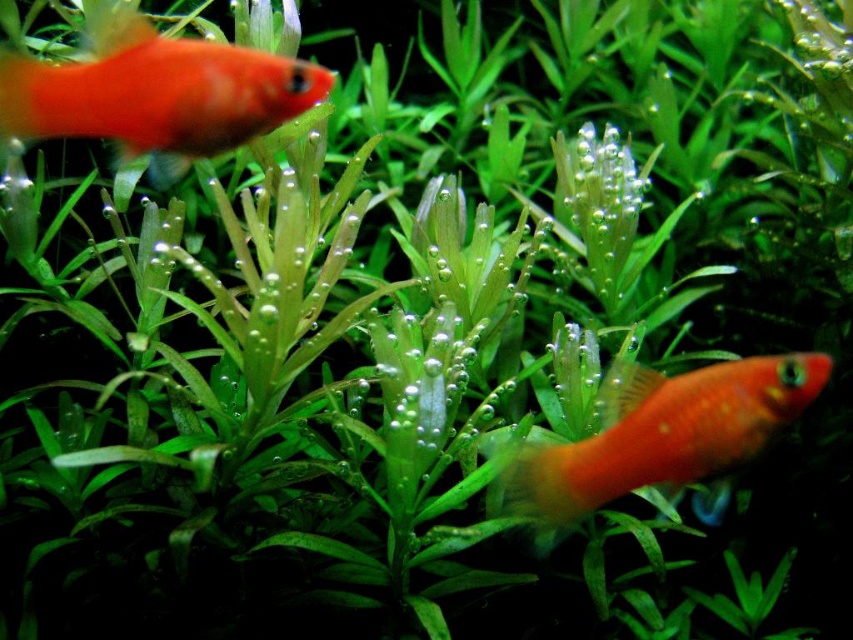
You are an underwater photographer aiming to capture a clear shot of both matte orange fish at upper left and matte orange fish at lower right. Which fish should you focus on first to ensure both are in focus?

You should focus on the matte orange fish at upper left first because it is closer to the viewer than the matte orange fish at lower right. By focusing on the closer fish, you can adjust the depth of field to include the farther one as well.

You are an underwater photographer aiming to capture both the matte orange fish at upper left and the matte orange fish at lower right in a single frame. Based on their positions, which fish is positioned higher in the water column?

The matte orange fish at upper left is located above the matte orange fish at lower right, so it is positioned higher in the water column.